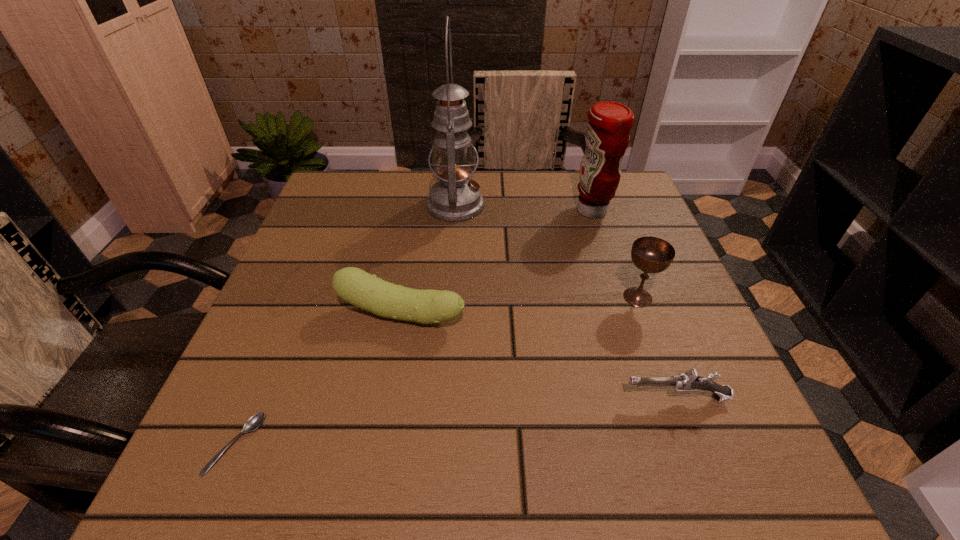
Identify the location of vacant space located 0.050m on the front of the chalice. This screenshot has height=540, width=960. (650, 332).

The height and width of the screenshot is (540, 960). I want to click on free space located on the left of the cucumber, so click(284, 314).

Where is `vacant space located 0.370m aimed along the barrel of the second nearest object`? vacant space located 0.370m aimed along the barrel of the second nearest object is located at coordinates (391, 397).

Locate an element on the screen. Image resolution: width=960 pixels, height=540 pixels. free space located aimed along the barrel of the second nearest object is located at coordinates (391, 397).

Locate an element on the screen. Image resolution: width=960 pixels, height=540 pixels. vacant space located 0.340m aimed along the barrel of the second nearest object is located at coordinates (410, 397).

This screenshot has width=960, height=540. I want to click on vacant space located on the right of the leftmost object, so click(x=387, y=444).

Where is `oil lamp that is at the far edge`? The height and width of the screenshot is (540, 960). oil lamp that is at the far edge is located at coordinates (455, 198).

Find the location of `condiment that is at the far edge`. condiment that is at the far edge is located at coordinates (607, 136).

Locate an element on the screen. The image size is (960, 540). object that is at the near edge is located at coordinates (255, 421).

Identify the location of cucumber that is at the left edge. This screenshot has height=540, width=960. (353, 285).